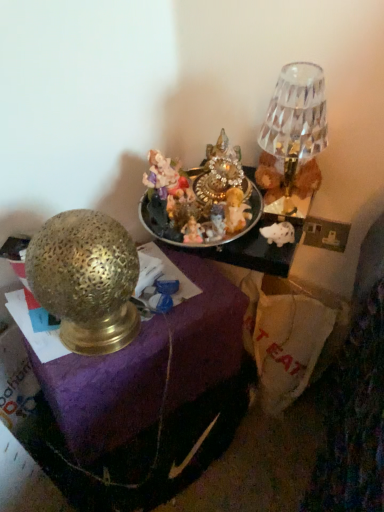
Identify the location of vacant space underneath gold textured lamp at left, acting as the first lamp starting from the left (from a real-world perspective). (116, 343).